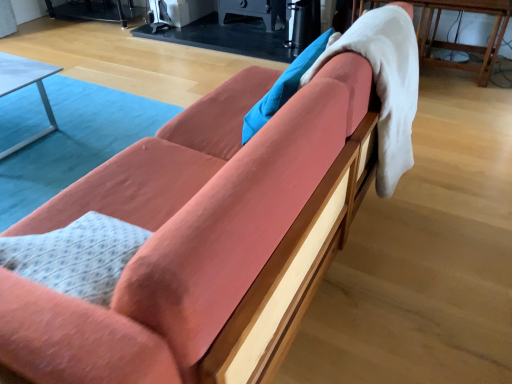
Question: From a real-world perspective, does wooden table at right, the 2th table from the left, stand above white fluffy blanket at upper right?

Choices:
 (A) yes
 (B) no

Answer: (B)

Question: Does wooden table at right, the 1th table positioned from the right, have a lesser width compared to white fluffy blanket at upper right?

Choices:
 (A) yes
 (B) no

Answer: (B)

Question: Considering the relative sizes of wooden table at right, the 1th table positioned from the right, and white fluffy blanket at upper right in the image provided, is wooden table at right, the 1th table positioned from the right, taller than white fluffy blanket at upper right?

Choices:
 (A) yes
 (B) no

Answer: (B)

Question: Is wooden table at right, the 1th table viewed from the top, shorter than white fluffy blanket at upper right?

Choices:
 (A) yes
 (B) no

Answer: (A)

Question: Is the position of wooden table at right, the 2th table from the left, less distant than that of white fluffy blanket at upper right?

Choices:
 (A) no
 (B) yes

Answer: (A)

Question: Would you say wooden table at right, the 1th table viewed from the top, contains white fluffy blanket at upper right?

Choices:
 (A) no
 (B) yes

Answer: (A)

Question: Could you tell me if metallic silver table at left, placed as the 2th table when sorted from top to bottom, is facing wooden table at right, the 2th table from the left?

Choices:
 (A) no
 (B) yes

Answer: (A)

Question: Is metallic silver table at left, which ranks as the second table in right-to-left order, wider than wooden table at right, the 1th table viewed from the top?

Choices:
 (A) no
 (B) yes

Answer: (B)

Question: Is metallic silver table at left, which ranks as the second table in right-to-left order, thinner than wooden table at right, arranged as the 2th table when ordered from the bottom?

Choices:
 (A) no
 (B) yes

Answer: (A)

Question: From a real-world perspective, is metallic silver table at left, the 1th table from the left, positioned under wooden table at right, the 2th table from the left, based on gravity?

Choices:
 (A) yes
 (B) no

Answer: (A)

Question: Is metallic silver table at left, which ranks as the second table in right-to-left order, at the left side of wooden table at right, arranged as the 2th table when ordered from the bottom?

Choices:
 (A) no
 (B) yes

Answer: (B)

Question: Is wooden table at right, arranged as the 2th table when ordered from the bottom, not within metallic silver table at left, which ranks as the second table in right-to-left order?

Choices:
 (A) yes
 (B) no

Answer: (A)